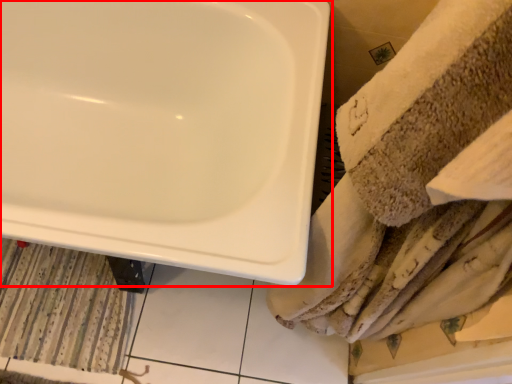
Question: From the image's perspective, considering the relative positions of sink (annotated by the red box) and bath mat in the image provided, where is sink (annotated by the red box) located with respect to the staircase?

Choices:
 (A) below
 (B) above

Answer: (B)